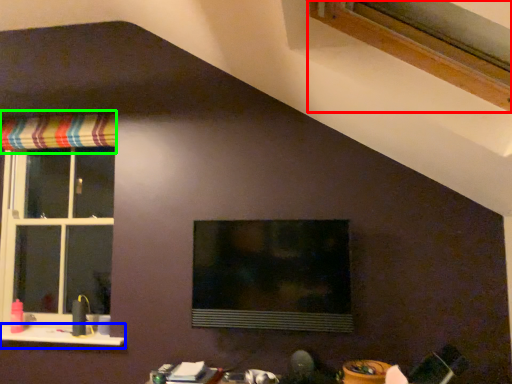
Question: Based on their relative distances, which object is farther from window (highlighted by a red box)? Choose from window sill (highlighted by a blue box) and curtain (highlighted by a green box).

Choices:
 (A) window sill
 (B) curtain

Answer: (A)